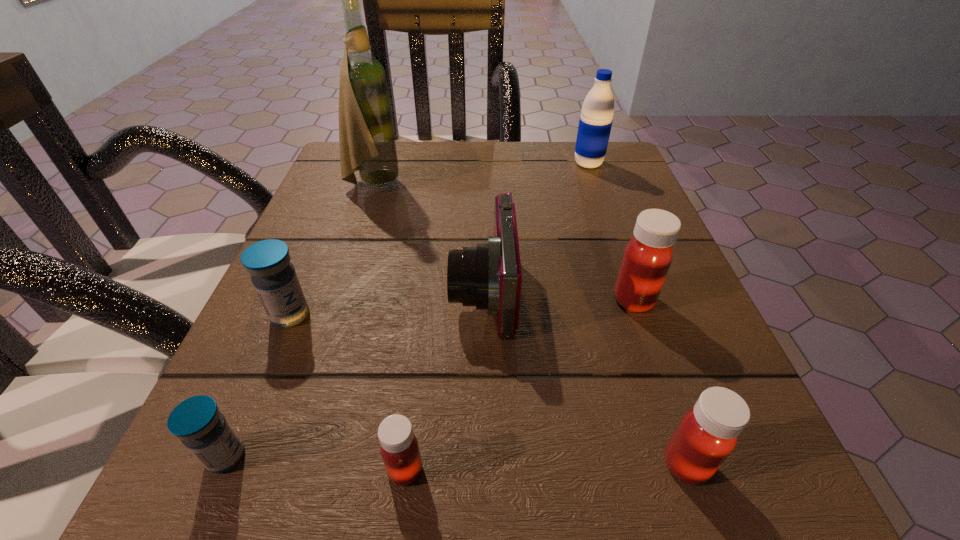
Where is `the smaller blue medicine`? This screenshot has width=960, height=540. the smaller blue medicine is located at coordinates (197, 422).

Where is `vacant point located 0.200m on the front-facing side of the wine bottle`? The image size is (960, 540). vacant point located 0.200m on the front-facing side of the wine bottle is located at coordinates (496, 185).

In order to click on vacant area located 0.090m on the front of the blue water bottle in this screenshot , I will do [x=599, y=194].

You are a GUI agent. You are given a task and a screenshot of the screen. Output one action in this format:
    pyautogui.click(x=<x>, y=<y>)
    Task: Click on the free spot located on the back of the tallest medicine
    
    Given the screenshot: What is the action you would take?
    pyautogui.click(x=600, y=204)

This screenshot has height=540, width=960. Find the location of `vacant space located on the front-facing side of the fifth object from left to right`. vacant space located on the front-facing side of the fifth object from left to right is located at coordinates (312, 292).

I want to click on free space located 0.210m on the front-facing side of the fifth object from left to right, so click(319, 292).

Where is `vacant area located on the front-facing side of the fifth object from left to right`? The height and width of the screenshot is (540, 960). vacant area located on the front-facing side of the fifth object from left to right is located at coordinates (300, 292).

This screenshot has width=960, height=540. Identify the location of vacant space located on the back of the bigger blue medicine. (307, 274).

Locate an element on the screen. vacant region located 0.330m on the left of the second biggest red medicine is located at coordinates (368, 464).

Find the location of a particular element. Image resolution: width=960 pixels, height=540 pixels. free spot located 0.400m on the back of the third medicine from left to right is located at coordinates (434, 237).